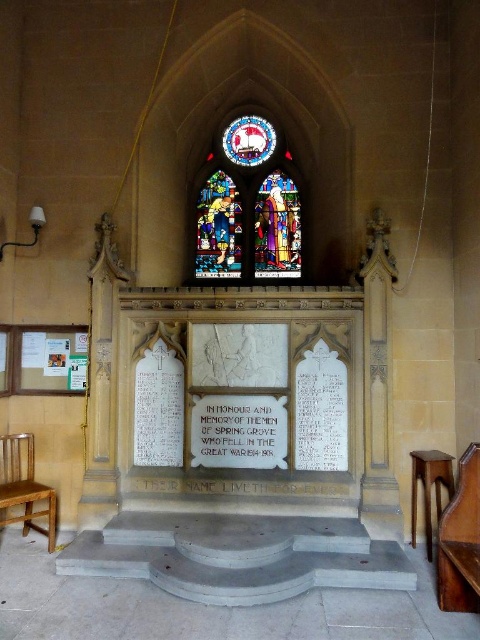
You are standing in front of the memorial altar and notice two points marked on it. The first point is at coordinate [263,122] and the second is at [254,461]. Which point is closer to you?

Point [263,122] is closer to you because it is further to the viewer than point [254,461].

You are a visitor standing at the entrance of the church, wanting to take a photo of both the stained glass window at center and the wooden chair at left. You have a camera with a 50mm lens. Knowing that the minimum distance between objects for the lens to focus on both is 10 feet, will you be able to capture both in focus?

The stained glass window at center and wooden chair at left are 9.73 feet apart from each other. Since the minimum required distance for the 50mm lens to focus on both is 10 feet, the distance is insufficient. Therefore, you cannot capture both in focus with this setup.